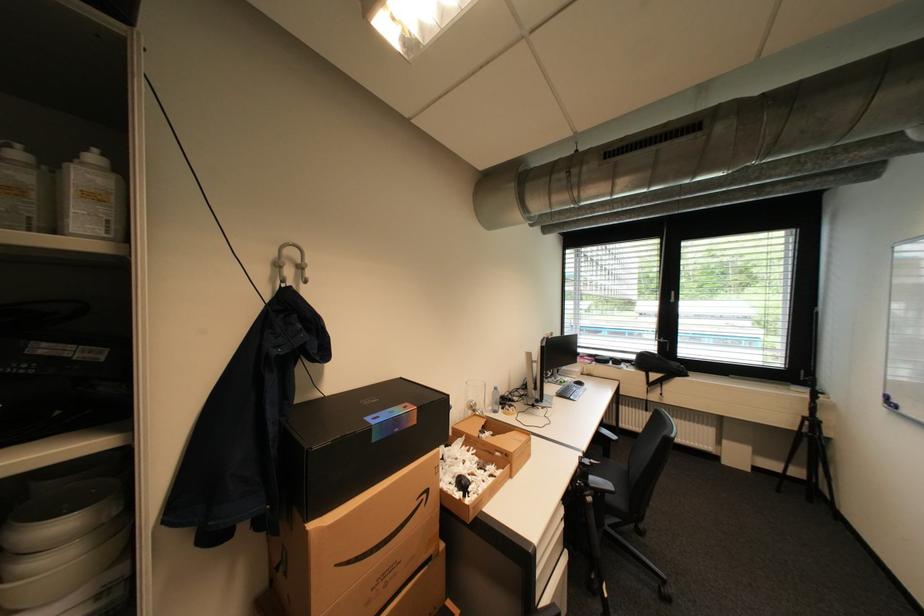
Where would you turn the window handle? Please return your answer as a coordinate pair (x, y).

(666, 341)